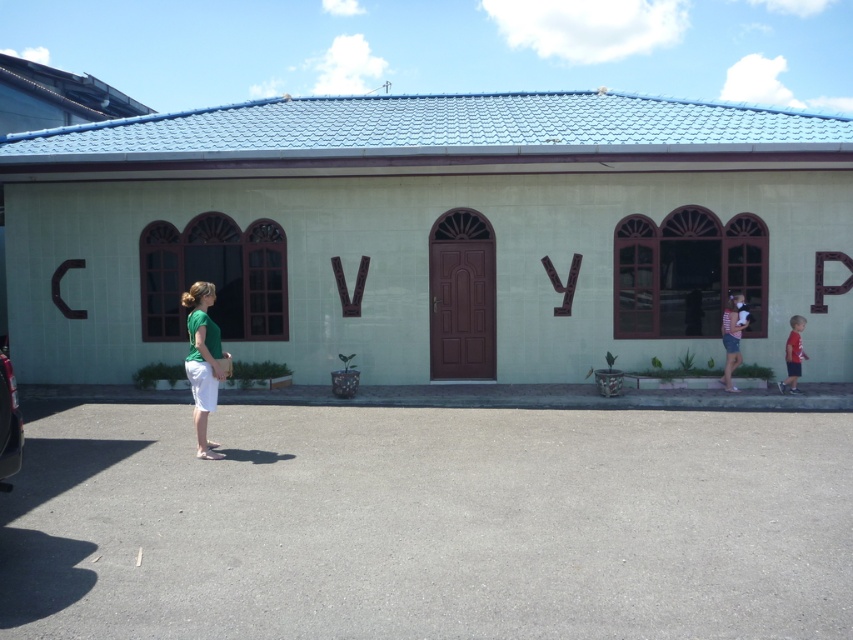
Does green matte shorts at lower left come behind metallic silver car at left?

Yes.

The width and height of the screenshot is (853, 640). I want to click on green matte shorts at lower left, so click(x=202, y=362).

Does point (201, 307) lie behind point (15, 458)?

Yes, it is behind point (15, 458).

Identify the location of green matte shorts at lower left. (202, 362).

Is point (727, 385) positioned before point (796, 356)?

No, it is not.

This screenshot has height=640, width=853. Describe the element at coordinates (730, 340) in the screenshot. I see `matte white shirt at right` at that location.

Locate an element on the screen. This screenshot has height=640, width=853. matte white shirt at right is located at coordinates (730, 340).

Is metallic silver car at left taller than matte white shirt at right?

No.

Who is taller, metallic silver car at left or matte white shirt at right?

matte white shirt at right

Is point (13, 380) closer to camera compared to point (726, 355)?

Yes.

What are the coordinates of `metallic silver car at left` in the screenshot? It's located at (9, 422).